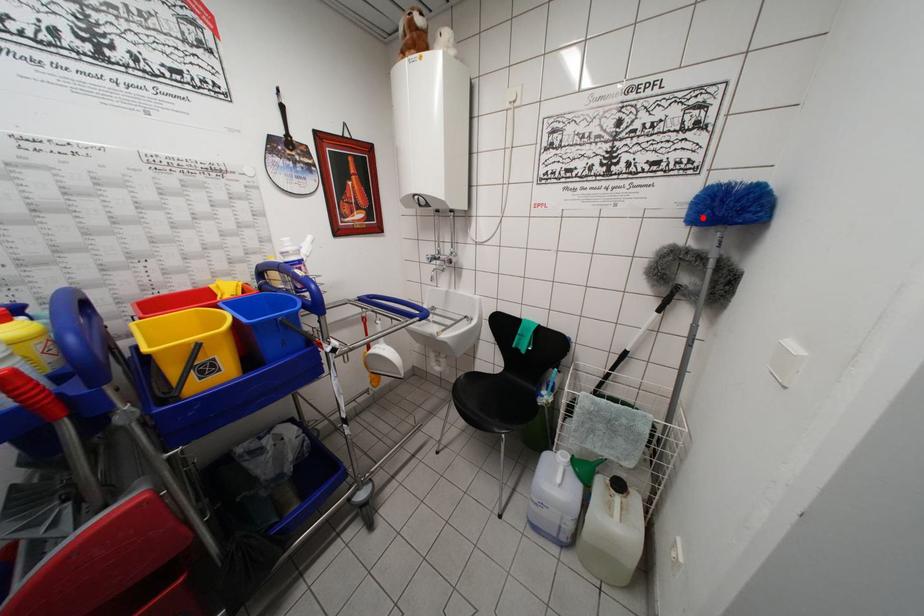
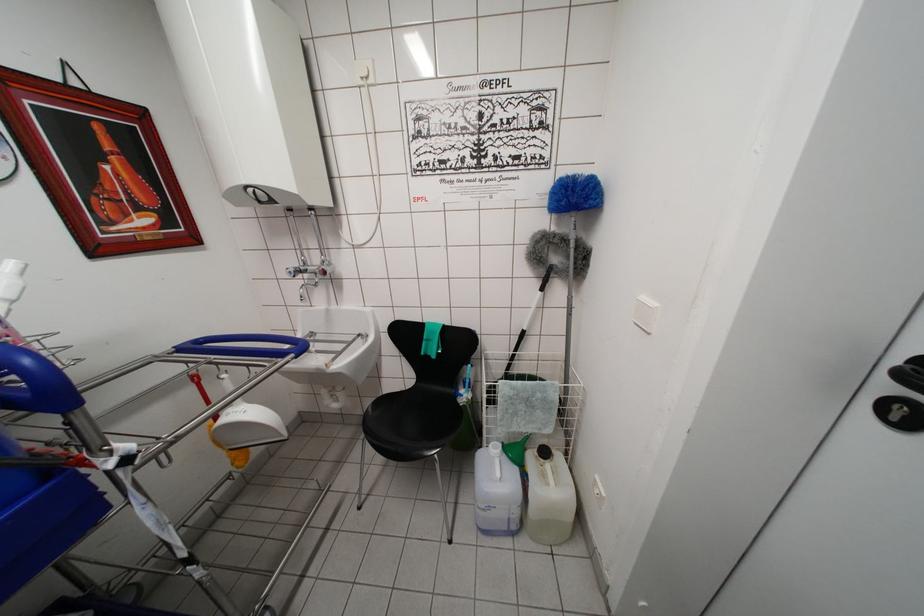
Question: I am providing you with two images of the same scene from different viewpoints. A red point is marked on the first image. Can you still see the location of the red point in image 2?

Choices:
 (A) Yes
 (B) No

Answer: (A)